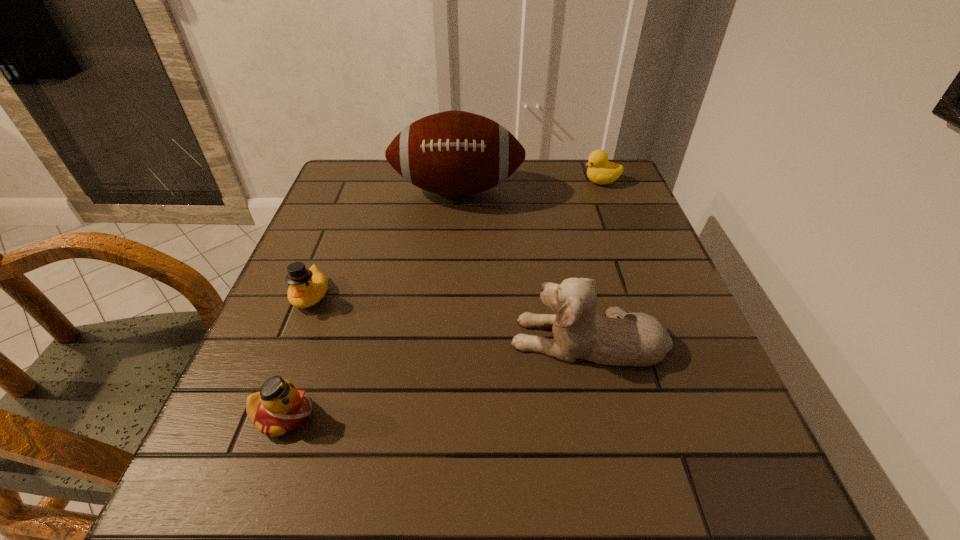
Locate an element on the screen. free space that satisfies the following two spatial constraints: 1. on the front-facing side of the rightmost duck; 2. on the front-facing side of the second nearest duck is located at coordinates (645, 295).

This screenshot has width=960, height=540. I want to click on free region that satisfies the following two spatial constraints: 1. on the front-facing side of the farthest duck; 2. on the front-facing side of the second farthest duck, so click(645, 295).

The width and height of the screenshot is (960, 540). What are the coordinates of `vacant point that satisfies the following two spatial constraints: 1. on the front-facing side of the farthest duck; 2. on the laces of the football` in the screenshot? It's located at (605, 191).

You are a GUI agent. You are given a task and a screenshot of the screen. Output one action in this format:
    pyautogui.click(x=<x>, y=<y>)
    Task: Click on the blank space that satisfies the following two spatial constraints: 1. on the front-facing side of the farthest duck; 2. on the front-facing side of the second nearest duck
    This screenshot has height=540, width=960.
    Given the screenshot: What is the action you would take?
    pyautogui.click(x=645, y=295)

The image size is (960, 540). What are the coordinates of `vacant position in the image that satisfies the following two spatial constraints: 1. on the front-facing side of the rightmost duck; 2. on the front-facing side of the second nearest duck` in the screenshot? It's located at (x=645, y=295).

Identify the location of vacant space that satisfies the following two spatial constraints: 1. on the laces of the tallest object; 2. on the face of the nearest duck. (442, 415).

Locate an element on the screen. free space that satisfies the following two spatial constraints: 1. on the laces of the football; 2. on the face of the nearest object is located at coordinates (442, 415).